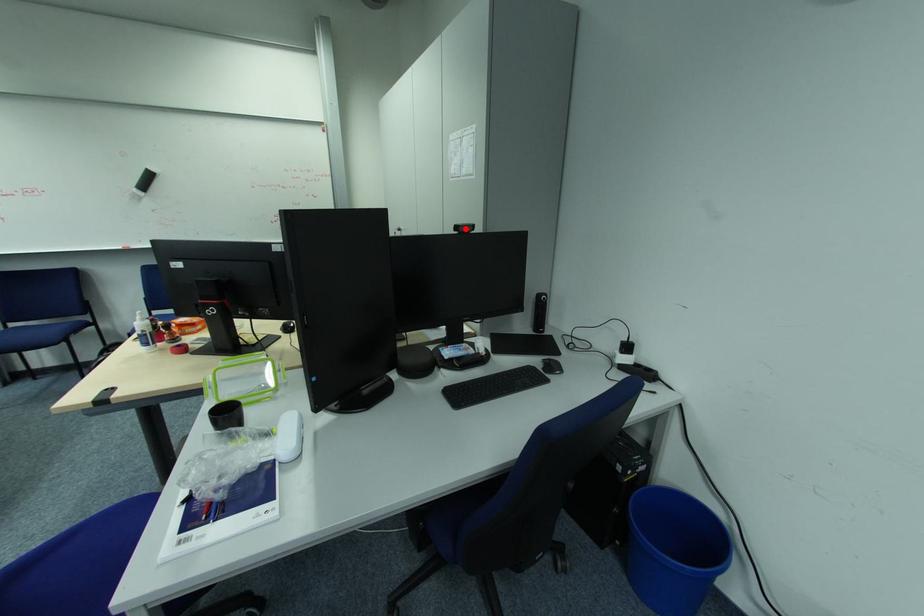
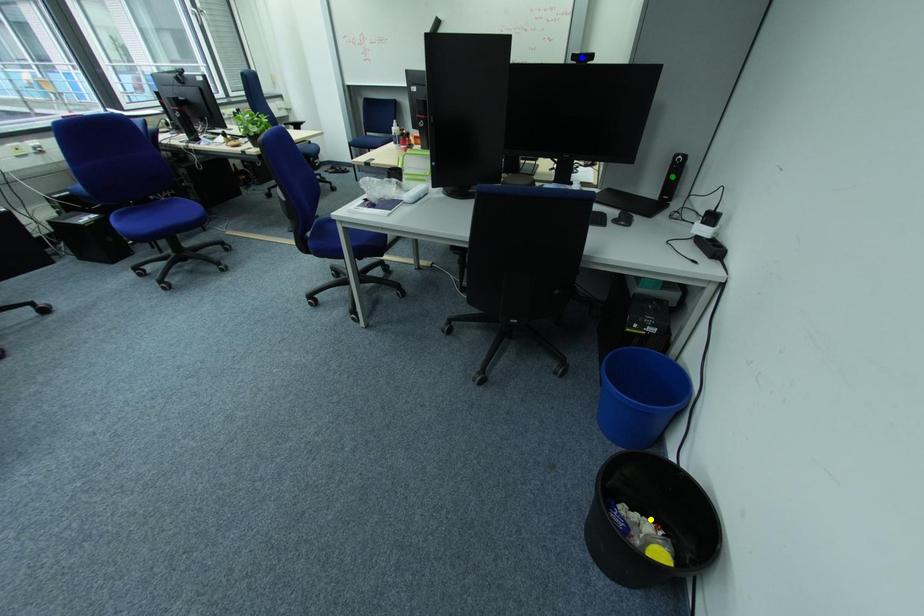
Question: I am providing you with two images of the same scene from different viewpoints. A red point is marked on the first image. You are given multiple points on the second image. Which point in image 2 is actually the same real-world point as the red point in image 1?

Choices:
 (A) blue point
 (B) green point
 (C) yellow point

Answer: (A)